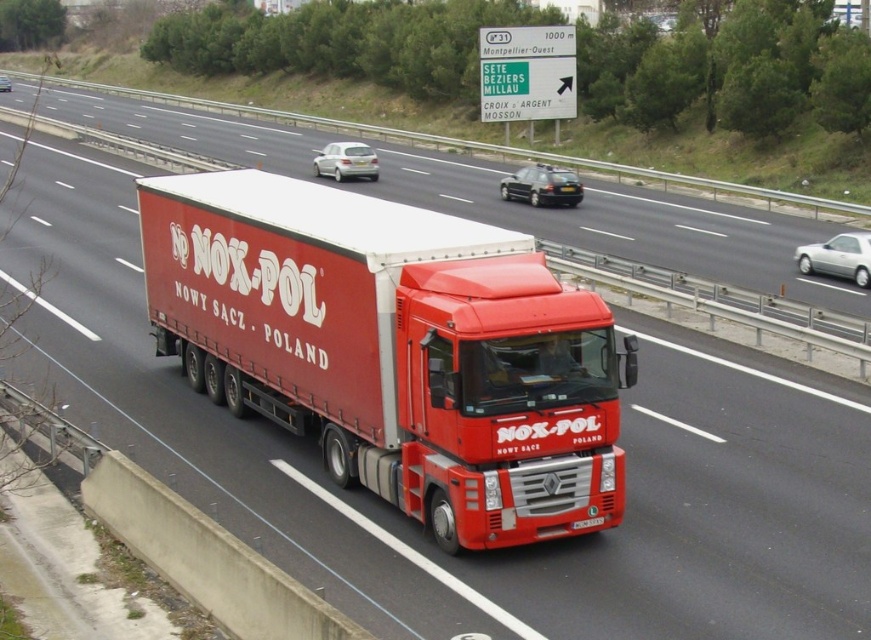
Between silver metallic sedan at right and satin silver sedan at center, which one is positioned lower?

silver metallic sedan at right is below.

Which is behind, point (861, 269) or point (339, 157)?

Point (339, 157)

You are a GUI agent. You are given a task and a screenshot of the screen. Output one action in this format:
    pyautogui.click(x=<x>, y=<y>)
    Task: Click on the silver metallic sedan at right
    This screenshot has height=640, width=871.
    Given the screenshot: What is the action you would take?
    pyautogui.click(x=838, y=257)

Image resolution: width=871 pixels, height=640 pixels. Identify the location of silver metallic sedan at right. (838, 257).

Can you confirm if matte red truck at center is wider than matte black car at center?

Indeed, matte red truck at center has a greater width compared to matte black car at center.

Does matte red truck at center have a greater height compared to matte black car at center?

Indeed, matte red truck at center has a greater height compared to matte black car at center.

Is point (508, 515) closer to camera compared to point (577, 188)?

Yes, point (508, 515) is closer to viewer.

Identify the location of matte red truck at center. (392, 348).

Is point (856, 241) positioned after point (535, 195)?

No, it is not.

Is silver metallic sedan at right bigger than matte black car at center?

No, silver metallic sedan at right is not bigger than matte black car at center.

Does point (814, 269) lie behind point (564, 180)?

No, (814, 269) is in front of (564, 180).

This screenshot has height=640, width=871. I want to click on silver metallic sedan at right, so click(x=838, y=257).